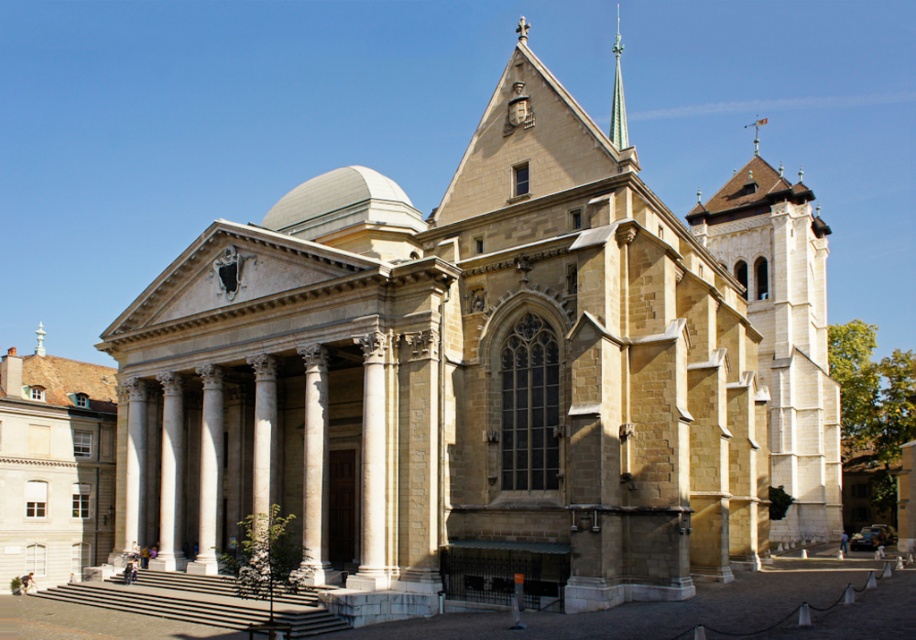
Does beige stone church at center have a greater width compared to green glass spire at upper center?

Yes.

Who is more forward, (58, 413) or (618, 138)?

Point (58, 413)

Does point (40, 486) come farther from viewer compared to point (620, 124)?

No, (40, 486) is closer to viewer.

This screenshot has width=916, height=640. What are the coordinates of `beige stone church at center` in the screenshot? It's located at (53, 465).